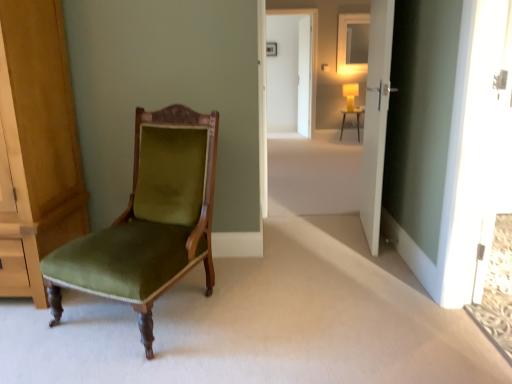
Identify the location of vacant area that lies between white matte door at center, the second door positioned from the top, and velvet green chair at left. The width and height of the screenshot is (512, 384). (285, 269).